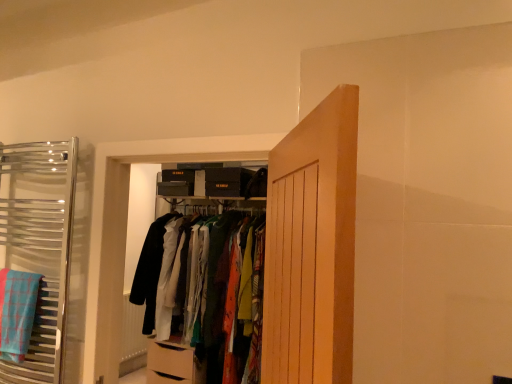
What is the approximate width of wooden door at center?

6.43 inches.

Locate an element on the screen. chrome towel rack at left, acting as the 1th closet starting from the front is located at coordinates (39, 244).

Measure the distance between point (175, 231) and camera.

The depth of point (175, 231) is 3.26 meters.

Looking at this image, how much space does matte fabric clothes at center, the 2th closet when ordered from front to back, occupy vertically?

matte fabric clothes at center, the 2th closet when ordered from front to back, is 1.50 meters tall.

Find the location of a particular element. Image resolution: width=512 pixels, height=384 pixels. wooden door at center is located at coordinates (312, 247).

What's the angular difference between matte fabric clothes at center, the 2th closet from the left, and chrome towel rack at left, acting as the 1th closet starting from the front,'s facing directions?

The facing directions of matte fabric clothes at center, the 2th closet from the left, and chrome towel rack at left, acting as the 1th closet starting from the front, are 0.0658 degrees apart.

Does matte fabric clothes at center, which appears as the 1th closet when viewed from the back, contain chrome towel rack at left, the second closet positioned from the right?

No, chrome towel rack at left, the second closet positioned from the right, is not inside matte fabric clothes at center, which appears as the 1th closet when viewed from the back.

Which is closer, (206, 332) or (10, 220)?

The point (10, 220) is in front.

Could you measure the distance between matte fabric clothes at center, the 2th closet from the left, and chrome towel rack at left, the 1th closet in the left-to-right sequence?

They are 4.00 feet apart.

How many degrees apart are the facing directions of matte fabric clothes at center, the 2th closet from the left, and wooden door at center?

The angle between the facing direction of matte fabric clothes at center, the 2th closet from the left, and the facing direction of wooden door at center is 56.9 degrees.

Is matte fabric clothes at center, which appears as the 1th closet when viewed from the back, looking in the opposite direction of wooden door at center?

No.

From the image's perspective, which is above, matte fabric clothes at center, which is counted as the 1th closet, starting from the right, or wooden door at center?

wooden door at center is shown above in the image.

Which is more to the left, matte fabric clothes at center, the 2th closet from the left, or wooden door at center?

matte fabric clothes at center, the 2th closet from the left, is more to the left.

Does blue plaid bath towel at left have a lesser width compared to matte fabric clothes at center, the 2th closet when ordered from front to back?

Indeed, blue plaid bath towel at left has a lesser width compared to matte fabric clothes at center, the 2th closet when ordered from front to back.

In the image, there is a blue plaid bath towel at left. At what (x,y) coordinates should I click in order to perform the action: click on closet below it (from a real-world perspective). Please return your answer as a coordinate pair (x, y). This screenshot has width=512, height=384. Looking at the image, I should click on (197, 271).

In terms of height, does blue plaid bath towel at left look taller or shorter compared to matte fabric clothes at center, which appears as the 1th closet when viewed from the back?

Clearly, blue plaid bath towel at left is shorter compared to matte fabric clothes at center, which appears as the 1th closet when viewed from the back.

Is wooden door at center thinner than blue plaid bath towel at left?

Incorrect, the width of wooden door at center is not less than that of blue plaid bath towel at left.

Does wooden door at center have a lesser height compared to blue plaid bath towel at left?

No, wooden door at center is not shorter than blue plaid bath towel at left.

From the image's perspective, which is above, wooden door at center or blue plaid bath towel at left?

From the image's view, wooden door at center is above.

Is wooden door at center in contact with blue plaid bath towel at left?

wooden door at center and blue plaid bath towel at left are not in contact.

Can you confirm if blue plaid bath towel at left is wider than wooden door at center?

No.

Is blue plaid bath towel at left oriented away from wooden door at center?

No, blue plaid bath towel at left's orientation is not away from wooden door at center.

Is wooden door at center far away from chrome towel rack at left, the second closet positioned from the right?

Yes, wooden door at center and chrome towel rack at left, the second closet positioned from the right, are quite far apart.

Considering their positions, is wooden door at center located in front of or behind chrome towel rack at left, the second closet positioned from the right?

wooden door at center is positioned closer to the viewer than chrome towel rack at left, the second closet positioned from the right.

In the image, is wooden door at center on the left side or the right side of chrome towel rack at left, acting as the second closet starting from the back?

In the image, wooden door at center appears on the right side of chrome towel rack at left, acting as the second closet starting from the back.

Is wooden door at center bigger than chrome towel rack at left, acting as the second closet starting from the back?

Yes.

Can you confirm if chrome towel rack at left, the 1th closet in the left-to-right sequence, is wider than wooden door at center?

Incorrect, the width of chrome towel rack at left, the 1th closet in the left-to-right sequence, does not surpass that of wooden door at center.

Can you confirm if chrome towel rack at left, acting as the 1th closet starting from the front, is positioned to the right of wooden door at center?

No.

Identify the location of door above the chrome towel rack at left, acting as the second closet starting from the back (from the image's perspective). The width and height of the screenshot is (512, 384). (312, 247).

Is point (62, 299) more distant than point (292, 352)?

That is True.

The width and height of the screenshot is (512, 384). What are the coordinates of `closet below the chrome towel rack at left, the 1th closet in the left-to-right sequence (from a real-world perspective)` in the screenshot? It's located at (197, 271).

From the image's perspective, count 2nd closets downward from the wooden door at center and point to it. Please provide its 2D coordinates.

[(197, 271)]

Estimate the real-world distances between objects in this image. Which object is closer to wooden door at center, blue plaid bath towel at left or matte fabric clothes at center, which appears as the 1th closet when viewed from the back?

blue plaid bath towel at left lies closer to wooden door at center than the other object.

Considering their positions, is matte fabric clothes at center, the 2th closet from the left, positioned further to wooden door at center than blue plaid bath towel at left?

matte fabric clothes at center, the 2th closet from the left, is further to wooden door at center.

Based on their spatial positions, is matte fabric clothes at center, the 2th closet from the left, or wooden door at center further from chrome towel rack at left, acting as the 1th closet starting from the front?

wooden door at center is further to chrome towel rack at left, acting as the 1th closet starting from the front.

Which object lies nearer to the anchor point matte fabric clothes at center, the 2th closet when ordered from front to back, wooden door at center or blue plaid bath towel at left?

blue plaid bath towel at left.

Estimate the real-world distances between objects in this image. Which object is further from wooden door at center, matte fabric clothes at center, the 2th closet from the left, or chrome towel rack at left, the 1th closet in the left-to-right sequence?

Based on the image, matte fabric clothes at center, the 2th closet from the left, appears to be further to wooden door at center.

Based on the photo, considering their positions, is chrome towel rack at left, acting as the second closet starting from the back, positioned further to blue plaid bath towel at left than matte fabric clothes at center, the 2th closet from the left?

matte fabric clothes at center, the 2th closet from the left.

Considering their positions, is chrome towel rack at left, the 1th closet in the left-to-right sequence, positioned further to blue plaid bath towel at left than wooden door at center?

The object further to blue plaid bath towel at left is wooden door at center.

From the image, which object appears to be nearer to wooden door at center, chrome towel rack at left, the 1th closet in the left-to-right sequence, or matte fabric clothes at center, the 2th closet when ordered from front to back?

Based on the image, chrome towel rack at left, the 1th closet in the left-to-right sequence, appears to be nearer to wooden door at center.

At what (x,y) coordinates should I click in order to perform the action: click on closet between wooden door at center and matte fabric clothes at center, which appears as the 1th closet when viewed from the back, along the z-axis. Please return your answer as a coordinate pair (x, y). The image size is (512, 384). Looking at the image, I should click on (39, 244).

At what (x,y) coordinates should I click in order to perform the action: click on bath towel between wooden door at center and matte fabric clothes at center, which is counted as the 1th closet, starting from the right, in the front-back direction. Please return your answer as a coordinate pair (x, y). The width and height of the screenshot is (512, 384). Looking at the image, I should click on (17, 312).

The width and height of the screenshot is (512, 384). I want to click on bath towel between chrome towel rack at left, acting as the 1th closet starting from the front, and matte fabric clothes at center, the 2th closet from the left, along the z-axis, so click(17, 312).